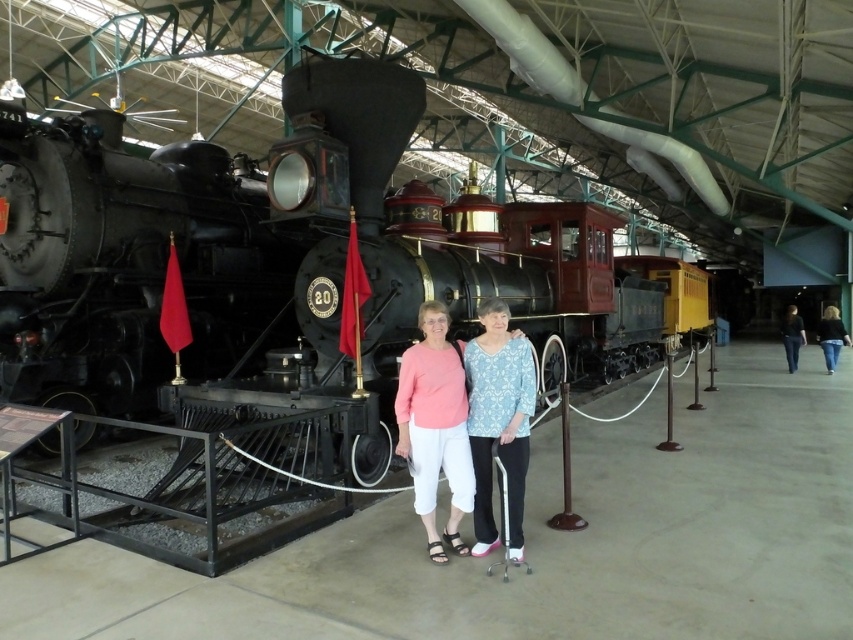
You are a photographer setting up a shot of the matte pink blouse at center and the black leather pants at right. Which object should you adjust to ensure both are centered in the frame?

The matte pink blouse at center is positioned on the left side of black leather pants at right, so you should move the black leather pants at right to the right to center both objects in the frame.

You are a photographer setting up a shot in the museum. You need to position a tripod between the polished black steam locomotive at left and the black leather pants at right. Since the locomotive is smaller, where should you place the tripod to ensure both subjects are framed properly?

Since the polished black steam locomotive at left is smaller than the black leather pants at right, you should place the tripod closer to the locomotive to balance their sizes in the frame.

You are a photographer taking a picture of the polished black steam locomotive at left and the black leather pants at right. Which object should you focus on first to ensure both are in sharp focus?

The polished black steam locomotive at left should be focused on first because it is positioned closer to the camera than the black leather pants at right, ensuring both will be in focus when starting with the closer object.